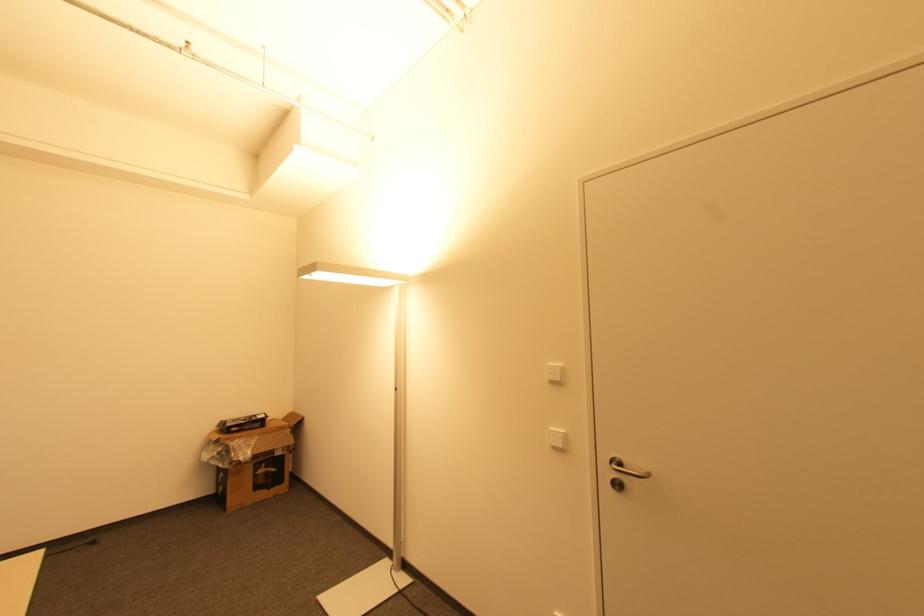
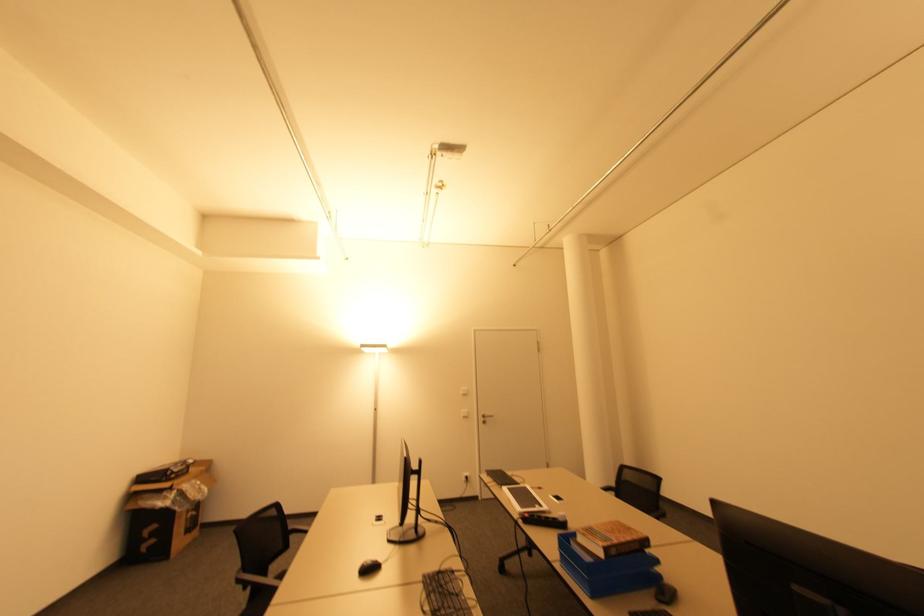
Find the pixel in the second image that matches point 621,487 in the first image.

(485, 422)